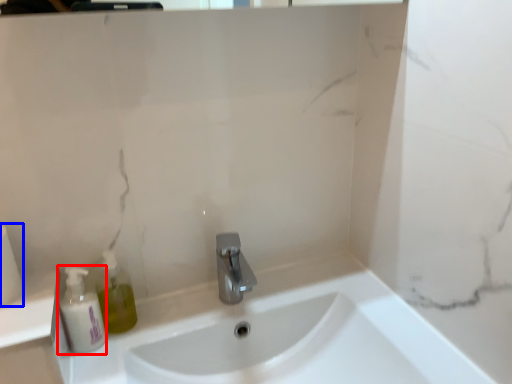
Question: Among these objects, which one is nearest to the camera, mouthwash (highlighted by a red box) or toilet paper (highlighted by a blue box)?

Choices:
 (A) mouthwash
 (B) toilet paper

Answer: (B)